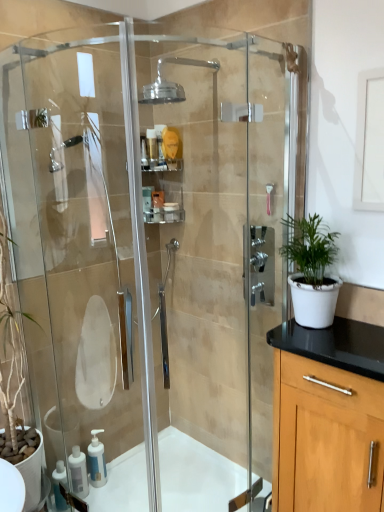
Question: From a real-world perspective, is clear plastic shelf at upper center located beneath white matte pot at right?

Choices:
 (A) yes
 (B) no

Answer: (B)

Question: Is clear plastic shelf at upper center not close to white matte pot at right?

Choices:
 (A) yes
 (B) no

Answer: (B)

Question: Does clear plastic shelf at upper center have a smaller size compared to white matte pot at right?

Choices:
 (A) no
 (B) yes

Answer: (B)

Question: Does clear plastic shelf at upper center have a lesser width compared to white matte pot at right?

Choices:
 (A) no
 (B) yes

Answer: (B)

Question: Considering the relative positions of clear plastic shelf at upper center and white matte pot at right in the image provided, is clear plastic shelf at upper center to the right of white matte pot at right from the viewer's perspective?

Choices:
 (A) no
 (B) yes

Answer: (A)

Question: Choose the correct answer: Is clear glass shower head at upper center inside white plastic soap dispenser at lower left, the first soap dispenser in the right-to-left sequence, or outside it?

Choices:
 (A) outside
 (B) inside

Answer: (A)

Question: Looking at their shapes, would you say clear glass shower head at upper center is wider or thinner than white plastic soap dispenser at lower left, arranged as the second soap dispenser when viewed from the left?

Choices:
 (A) wide
 (B) thin

Answer: (A)

Question: From the image's perspective, relative to white plastic soap dispenser at lower left, the first soap dispenser in the right-to-left sequence, is clear glass shower head at upper center above or below?

Choices:
 (A) above
 (B) below

Answer: (A)

Question: Relative to white plastic soap dispenser at lower left, arranged as the second soap dispenser when viewed from the left, is clear glass shower head at upper center in front or behind?

Choices:
 (A) behind
 (B) front

Answer: (B)

Question: Do you think white plastic soap dispenser at lower left, the first soap dispenser in the right-to-left sequence, is within transparent glass shower door at left, or outside of it?

Choices:
 (A) outside
 (B) inside

Answer: (A)

Question: From their relative heights in the image, would you say white plastic soap dispenser at lower left, arranged as the second soap dispenser when viewed from the left, is taller or shorter than transparent glass shower door at left?

Choices:
 (A) tall
 (B) short

Answer: (B)

Question: Would you say white plastic soap dispenser at lower left, the first soap dispenser in the right-to-left sequence, is to the left or to the right of transparent glass shower door at left in the picture?

Choices:
 (A) left
 (B) right

Answer: (A)

Question: Considering the positions of point (97, 454) and point (77, 423), is point (97, 454) closer or farther from the camera than point (77, 423)?

Choices:
 (A) farther
 (B) closer

Answer: (B)

Question: Which is correct: white glossy bath at lower left is inside clear plastic container at center, the first toiletry in the top-to-bottom sequence, or outside of it?

Choices:
 (A) inside
 (B) outside

Answer: (B)

Question: Considering the positions of white glossy bath at lower left and clear plastic container at center, the 3th toiletry positioned from the bottom, in the image, is white glossy bath at lower left wider or thinner than clear plastic container at center, the 3th toiletry positioned from the bottom,?

Choices:
 (A) thin
 (B) wide

Answer: (B)